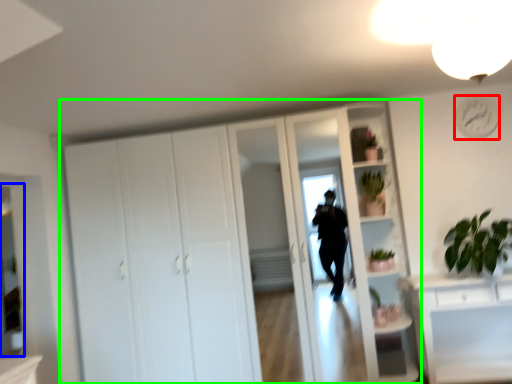
Question: Estimate the real-world distances between objects in this image. Which object is closer to clock (highlighted by a red box), mirror (highlighted by a blue box) or cupboard (highlighted by a green box)?

Choices:
 (A) mirror
 (B) cupboard

Answer: (B)